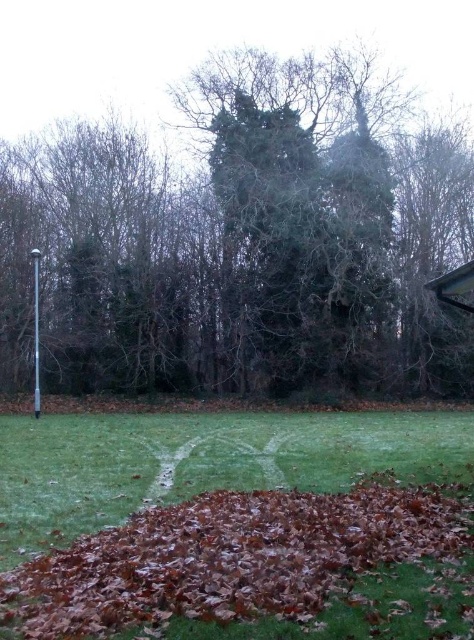
Question: Does green leafy tree at center have a smaller size compared to brown leaf litter at lower center?

Choices:
 (A) no
 (B) yes

Answer: (A)

Question: Which point appears closest to the camera in this image?

Choices:
 (A) (316, 320)
 (B) (291, 570)

Answer: (B)

Question: From the image, what is the correct spatial relationship of green leafy tree at center in relation to brown leaf litter at lower center?

Choices:
 (A) above
 (B) below

Answer: (A)

Question: Is green leafy tree at center positioned before brown leaf litter at lower center?

Choices:
 (A) no
 (B) yes

Answer: (A)

Question: Among these points, which one is farthest from the camera?

Choices:
 (A) (449, 228)
 (B) (445, 458)

Answer: (A)